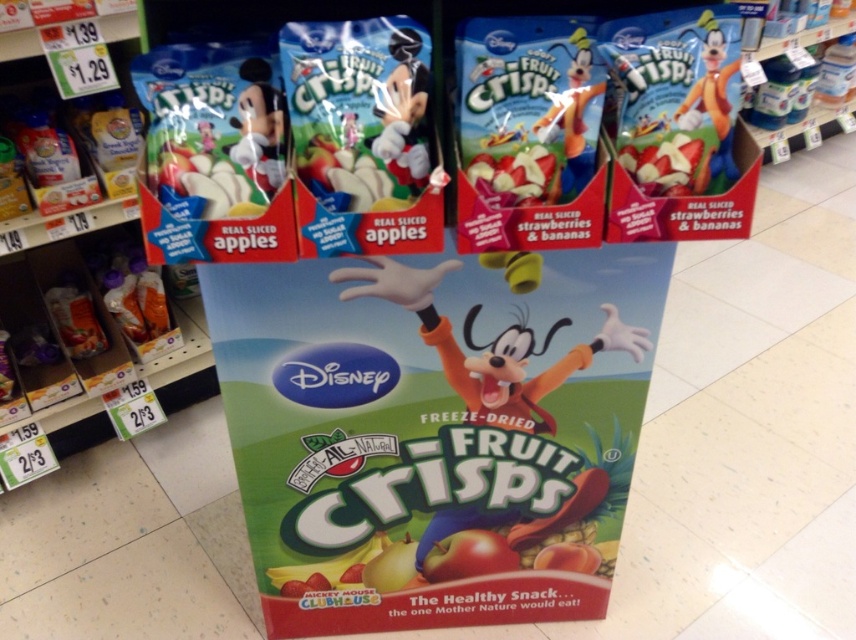
Is point (152, 300) farther from camera compared to point (242, 144)?

Yes, it is.

Locate an element on the screen. The height and width of the screenshot is (640, 856). translucent plastic bag at lower left is located at coordinates point(134,294).

Looking at this image, between orange fabric goofy at center and matte plastic mickey mouse at upper center, which one is positioned lower?

orange fabric goofy at center is below.

Which is more to the right, orange fabric goofy at center or matte plastic mickey mouse at upper center?

orange fabric goofy at center

Does point (413, 308) come farther from viewer compared to point (253, 140)?

Yes, point (413, 308) is behind point (253, 140).

The image size is (856, 640). I want to click on orange fabric goofy at center, so click(488, 346).

Can you confirm if translucent plastic bag at lower left is bigger than matte plastic toy at center?

Yes, translucent plastic bag at lower left is bigger than matte plastic toy at center.

Is the position of translucent plastic bag at lower left more distant than that of matte plastic toy at center?

That is True.

Is point (155, 316) closer to viewer compared to point (575, 58)?

No, (155, 316) is behind (575, 58).

The image size is (856, 640). Find the location of `translucent plastic bag at lower left`. translucent plastic bag at lower left is located at coordinates (134, 294).